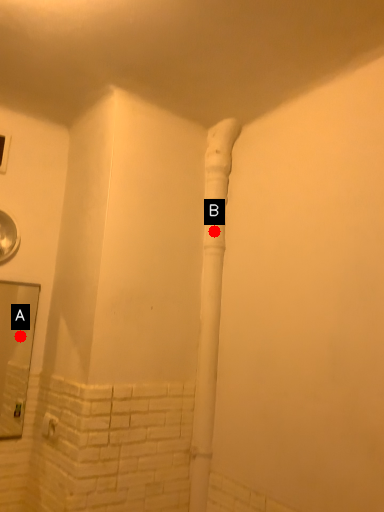
Question: Two points are circled on the image, labeled by A and B beside each circle. Among these points, which one is farthest from the camera?

Choices:
 (A) A is further
 (B) B is further

Answer: (A)